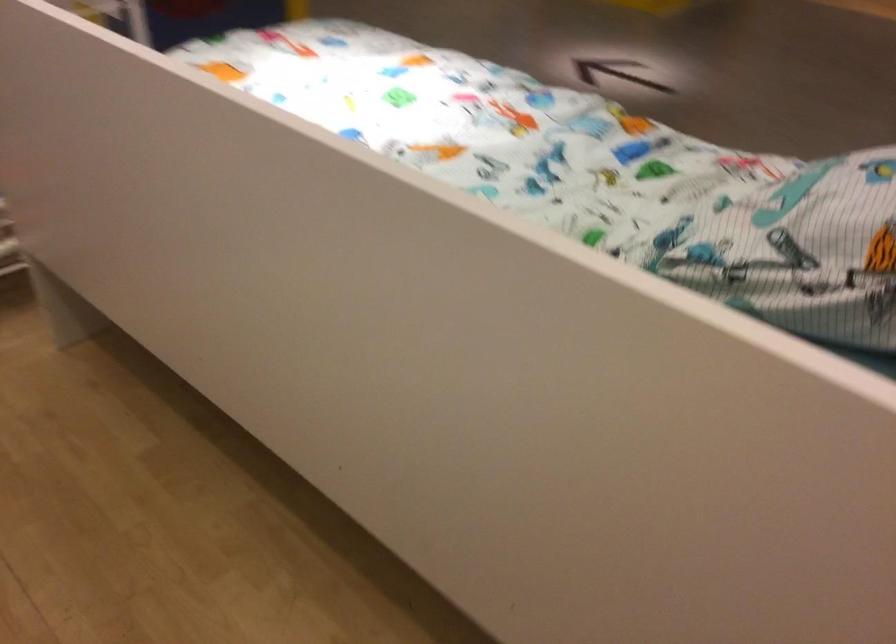
Locate an element on the screen. Image resolution: width=896 pixels, height=644 pixels. white bed rail is located at coordinates (42, 163).